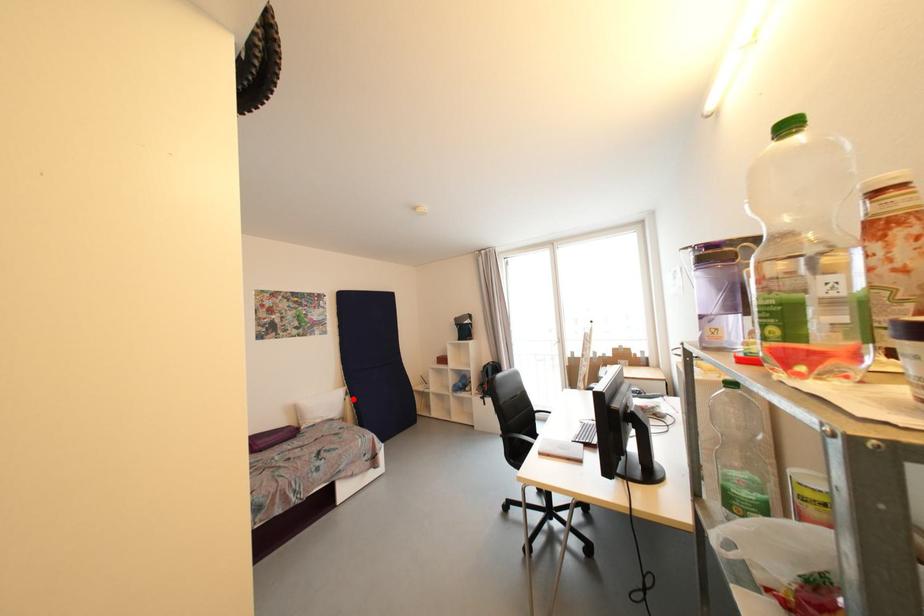
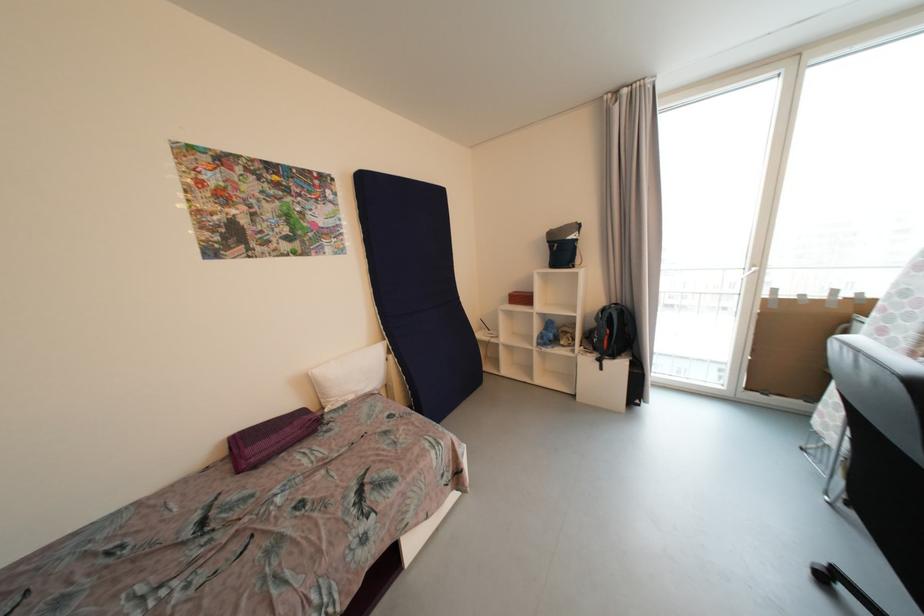
The point at the highlighted location is marked in the first image. Where is the corresponding point in the second image?

(396, 359)